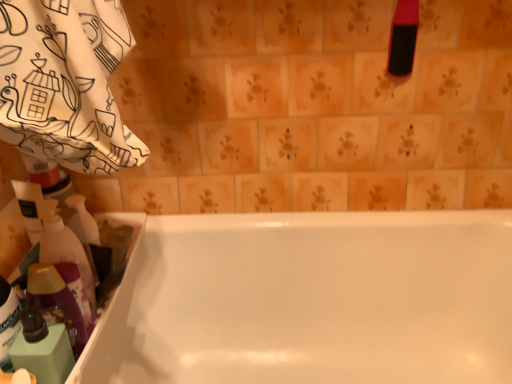
Question: Is translucent plastic bottle at left, the second cleaning product positioned from the top, not inside translucent plastic bottle at lower left, arranged as the first cleaning product when viewed from the left?

Choices:
 (A) no
 (B) yes

Answer: (B)

Question: Would you say translucent plastic bottle at left, which appears as the second cleaning product when ordered from the bottom, is a long distance from translucent plastic bottle at lower left, arranged as the first cleaning product when viewed from the left?

Choices:
 (A) no
 (B) yes

Answer: (A)

Question: Does translucent plastic bottle at left, the second cleaning product positioned from the top, appear on the right side of translucent plastic bottle at lower left, placed as the third cleaning product when sorted from top to bottom?

Choices:
 (A) yes
 (B) no

Answer: (A)

Question: Is translucent plastic bottle at left, the second cleaning product positioned from the top, shorter than translucent plastic bottle at lower left, which is the 1th cleaning product in bottom-to-top order?

Choices:
 (A) yes
 (B) no

Answer: (B)

Question: Does translucent plastic bottle at left, marked as the second cleaning product in a right-to-left arrangement, turn towards translucent plastic bottle at lower left, arranged as the first cleaning product when viewed from the left?

Choices:
 (A) yes
 (B) no

Answer: (B)

Question: From the image's perspective, is translucent plastic bottle at left, the second cleaning product in the left-to-right sequence, under translucent plastic bottle at lower left, placed as the third cleaning product when sorted from top to bottom?

Choices:
 (A) no
 (B) yes

Answer: (A)

Question: Is translucent plastic bottle at lower left, placed as the 3th cleaning product when sorted from right to left, not close to white glossy bathtub at center?

Choices:
 (A) no
 (B) yes

Answer: (A)

Question: From a real-world perspective, is translucent plastic bottle at lower left, placed as the third cleaning product when sorted from top to bottom, positioned over white glossy bathtub at center based on gravity?

Choices:
 (A) no
 (B) yes

Answer: (B)

Question: Is white glossy bathtub at center at the back of translucent plastic bottle at lower left, which is the 1th cleaning product in bottom-to-top order?

Choices:
 (A) yes
 (B) no

Answer: (B)

Question: From the image's perspective, is translucent plastic bottle at lower left, placed as the 3th cleaning product when sorted from right to left, over white glossy bathtub at center?

Choices:
 (A) yes
 (B) no

Answer: (A)

Question: Could you tell me if translucent plastic bottle at lower left, arranged as the first cleaning product when viewed from the left, is turned towards white glossy bathtub at center?

Choices:
 (A) no
 (B) yes

Answer: (A)

Question: Can you confirm if translucent plastic bottle at lower left, which is the 1th cleaning product in bottom-to-top order, is wider than white glossy bathtub at center?

Choices:
 (A) no
 (B) yes

Answer: (A)

Question: From a real-world perspective, is pink rubber brush at upper right, acting as the 3th cleaning product starting from the bottom, over white glossy bathtub at center?

Choices:
 (A) yes
 (B) no

Answer: (A)